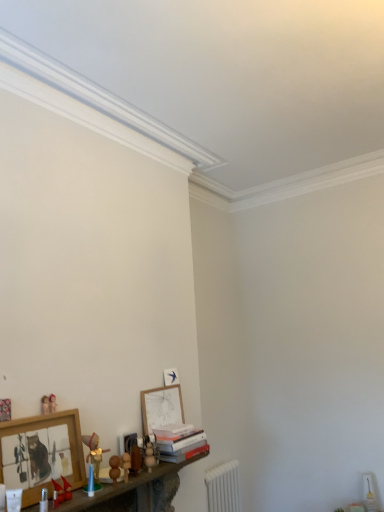
Question: Is wooden toy at lower center, the 6th toy from the left, far from matte wooden figurine at lower left, the 2th toy in the left-to-right sequence?

Choices:
 (A) yes
 (B) no

Answer: (B)

Question: Is wooden toy at lower center, the 1th toy positioned from the right, outside matte wooden figurine at lower left, acting as the fifth toy starting from the right?

Choices:
 (A) yes
 (B) no

Answer: (A)

Question: Can you confirm if wooden toy at lower center, the 1th toy positioned from the right, is shorter than matte wooden figurine at lower left, acting as the fifth toy starting from the right?

Choices:
 (A) no
 (B) yes

Answer: (A)

Question: Is wooden toy at lower center, the 6th toy from the left, directly adjacent to matte wooden figurine at lower left, acting as the fifth toy starting from the right?

Choices:
 (A) no
 (B) yes

Answer: (A)

Question: Can you confirm if wooden toy at lower center, the 1th toy positioned from the right, is smaller than matte wooden figurine at lower left, acting as the fifth toy starting from the right?

Choices:
 (A) no
 (B) yes

Answer: (A)

Question: Is wooden framed picture at lower left, positioned as the first picture frame in front-to-back order, spatially inside hardcover books at lower center, or outside of it?

Choices:
 (A) inside
 (B) outside

Answer: (B)

Question: Considering the positions of wooden framed picture at lower left, which ranks as the second picture frame in back-to-front order, and hardcover books at lower center in the image, is wooden framed picture at lower left, which ranks as the second picture frame in back-to-front order, taller or shorter than hardcover books at lower center?

Choices:
 (A) tall
 (B) short

Answer: (A)

Question: Considering the positions of wooden framed picture at lower left, which is the first picture frame from left to right, and hardcover books at lower center in the image, is wooden framed picture at lower left, which is the first picture frame from left to right, bigger or smaller than hardcover books at lower center?

Choices:
 (A) small
 (B) big

Answer: (B)

Question: From a real-world perspective, is wooden framed picture at lower left, positioned as the first picture frame in front-to-back order, above or below hardcover books at lower center?

Choices:
 (A) above
 (B) below

Answer: (A)

Question: Is white plastic radiator at lower right spatially inside wooden toy at lower center, the 6th toy from the left, or outside of it?

Choices:
 (A) outside
 (B) inside

Answer: (A)

Question: Visually, is white plastic radiator at lower right positioned to the left or to the right of wooden toy at lower center, the 1th toy positioned from the right?

Choices:
 (A) right
 (B) left

Answer: (A)

Question: Does point (210, 500) appear closer or farther from the camera than point (150, 459)?

Choices:
 (A) closer
 (B) farther

Answer: (B)

Question: In terms of height, does white plastic radiator at lower right look taller or shorter compared to wooden toy at lower center, the 1th toy positioned from the right?

Choices:
 (A) tall
 (B) short

Answer: (A)

Question: Do you think matte wooden toy at lower left, which is counted as the first toy, starting from the left, is within matte red toy boat at lower left, which is the 3th toy from left to right, or outside of it?

Choices:
 (A) inside
 (B) outside

Answer: (B)

Question: From a real-world perspective, is matte wooden toy at lower left, the sixth toy positioned from the right, physically located above or below matte red toy boat at lower left, arranged as the fourth toy when viewed from the right?

Choices:
 (A) above
 (B) below

Answer: (A)